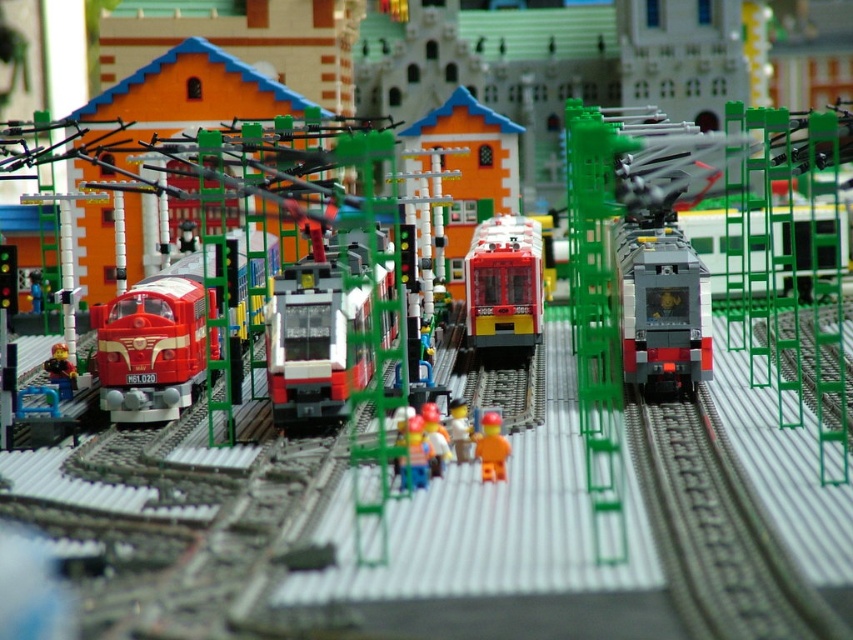
What do you see at coordinates (717, 529) in the screenshot?
I see `metallic gray train track at center` at bounding box center [717, 529].

Looking at this image, is metallic gray train track at center further to the viewer compared to orange matte figure at center?

No, metallic gray train track at center is in front of orange matte figure at center.

Identify the location of metallic gray train track at center. (717, 529).

At what (x,y) coordinates should I click in order to perform the action: click on metallic gray train track at center. Please return your answer as a coordinate pair (x, y). The height and width of the screenshot is (640, 853). Looking at the image, I should click on (717, 529).

Can you confirm if metallic gray train track at center is positioned above smooth plastic toy at center?

Incorrect, metallic gray train track at center is not positioned above smooth plastic toy at center.

Who is more distant from viewer, (795, 573) or (447, 448)?

Point (447, 448)

This screenshot has width=853, height=640. I want to click on metallic gray train track at center, so click(x=717, y=529).

Is matte red train at center behind orange matte figure at center?

Yes, matte red train at center is behind orange matte figure at center.

Does matte red train at center have a larger size compared to orange matte figure at center?

Yes, matte red train at center is bigger than orange matte figure at center.

Is point (509, 256) farther from camera compared to point (498, 452)?

Yes.

Locate an element on the screen. The width and height of the screenshot is (853, 640). matte red train at center is located at coordinates (503, 284).